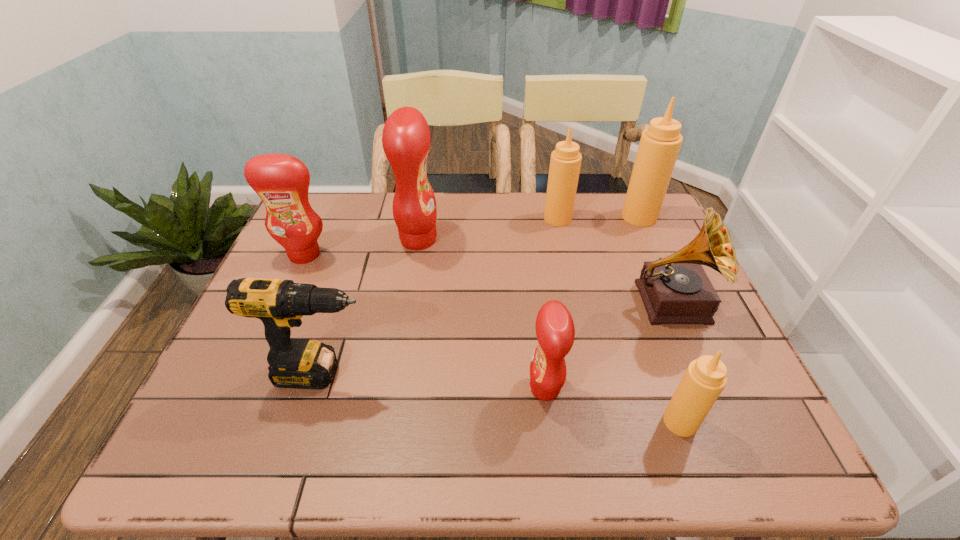
Find the location of a particular element. free spot between the fourth object from left to right and the biggest tan condiment is located at coordinates (592, 302).

Find the location of a particular element. The height and width of the screenshot is (540, 960). vacant area that lies between the fifth object from right to left and the biggest red condiment is located at coordinates (482, 314).

Locate an element on the screen. This screenshot has width=960, height=540. vacant region between the fifth farthest object and the black drill is located at coordinates (496, 338).

Identify which object is located as the fifth nearest to the fifth object from left to right. Please provide its 2D coordinates. Your answer should be formatted as a tuple, i.e. [(x, y)], where the tuple contains the x and y coordinates of a point satisfying the conditions above.

[(705, 378)]

Select which object is the closest to the fifth farthest object. Please provide its 2D coordinates. Your answer should be formatted as a tuple, i.e. [(x, y)], where the tuple contains the x and y coordinates of a point satisfying the conditions above.

[(705, 378)]

The width and height of the screenshot is (960, 540). In order to click on condiment that is the second closest to the third condiment from right to left in this screenshot , I will do 406,137.

Where is `the closest condiment relative to the second biggest red condiment`? This screenshot has height=540, width=960. the closest condiment relative to the second biggest red condiment is located at coordinates (406, 137).

Select which red condiment is the third closest to the phonograph record. Please provide its 2D coordinates. Your answer should be formatted as a tuple, i.e. [(x, y)], where the tuple contains the x and y coordinates of a point satisfying the conditions above.

[(282, 181)]

Identify the location of the third closest red condiment to the phonograph record. (282, 181).

Locate an element on the screen. The height and width of the screenshot is (540, 960). the third closest tan condiment to the second condiment from left to right is located at coordinates (705, 378).